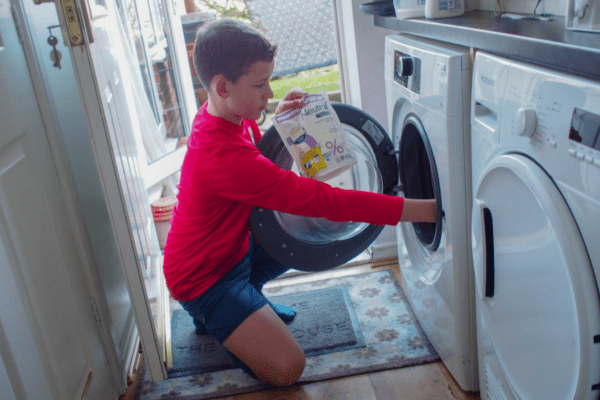
Locate an element on the screen. Image resolution: width=600 pixels, height=400 pixels. dryer is located at coordinates (522, 155).